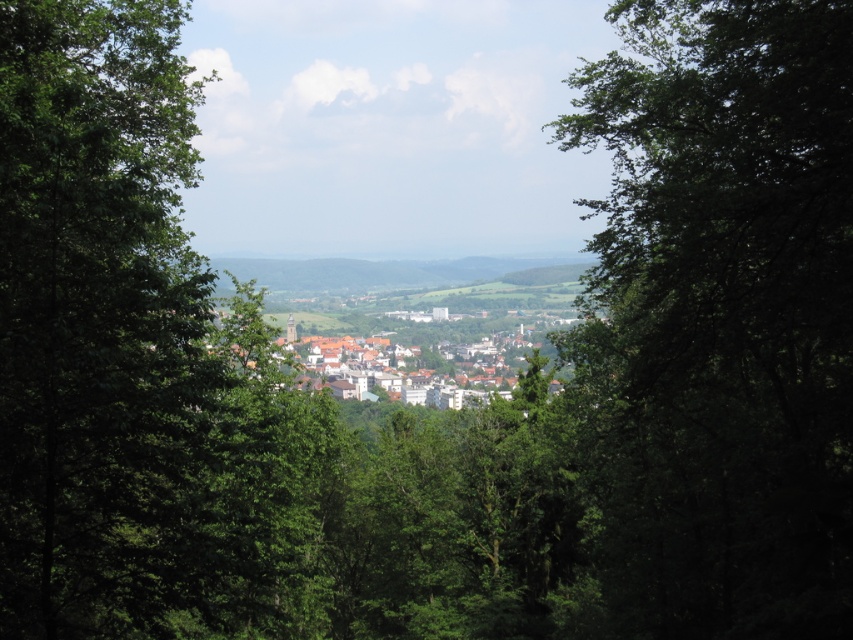
Question: Estimate the real-world distances between objects in this image. Which object is farther from the green leafy tree at left?

Choices:
 (A) green leafy tree at center
 (B) white matte buildings at center

Answer: (A)

Question: Which point is closer to the camera?

Choices:
 (A) white matte buildings at center
 (B) green leafy tree at center
 (C) green leafy tree at left

Answer: (C)

Question: Which point is closer to the camera?

Choices:
 (A) white matte buildings at center
 (B) green leafy tree at left

Answer: (B)

Question: Can you confirm if green leafy tree at left is positioned above white matte buildings at center?

Choices:
 (A) yes
 (B) no

Answer: (A)

Question: Can you confirm if green leafy tree at left is wider than white matte buildings at center?

Choices:
 (A) no
 (B) yes

Answer: (A)

Question: Is green leafy tree at center above white matte buildings at center?

Choices:
 (A) yes
 (B) no

Answer: (A)